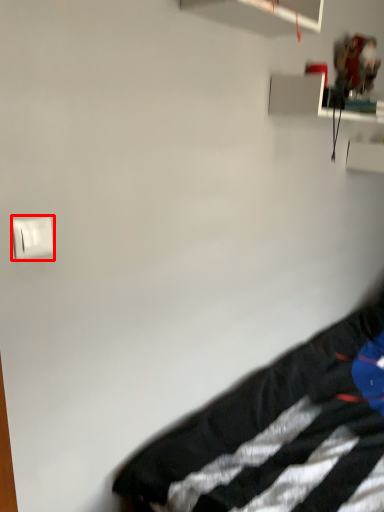
Question: Considering the relative positions of light switch (annotated by the red box) and furniture in the image provided, where is light switch (annotated by the red box) located with respect to the staircase?

Choices:
 (A) left
 (B) right

Answer: (A)